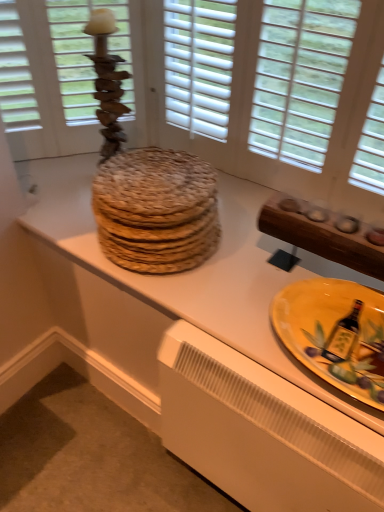
Question: Is wooden candlestick at upper left taller than yellow glazed plate at lower right?

Choices:
 (A) no
 (B) yes

Answer: (B)

Question: Is wooden candlestick at upper left further to camera compared to yellow glazed plate at lower right?

Choices:
 (A) yes
 (B) no

Answer: (A)

Question: From the image's perspective, is wooden candlestick at upper left located beneath yellow glazed plate at lower right?

Choices:
 (A) yes
 (B) no

Answer: (B)

Question: Is wooden candlestick at upper left surrounding yellow glazed plate at lower right?

Choices:
 (A) yes
 (B) no

Answer: (B)

Question: Is wooden candlestick at upper left aimed at yellow glazed plate at lower right?

Choices:
 (A) no
 (B) yes

Answer: (A)

Question: Considering the relative sizes of wooden candlestick at upper left and yellow glazed plate at lower right in the image provided, is wooden candlestick at upper left thinner than yellow glazed plate at lower right?

Choices:
 (A) no
 (B) yes

Answer: (B)

Question: From a real-world perspective, is yellow glazed plate at lower right physically above white plastic radiator at lower center?

Choices:
 (A) yes
 (B) no

Answer: (A)

Question: Is yellow glazed plate at lower right positioned before white plastic radiator at lower center?

Choices:
 (A) yes
 (B) no

Answer: (A)

Question: Is yellow glazed plate at lower right oriented towards white plastic radiator at lower center?

Choices:
 (A) yes
 (B) no

Answer: (B)

Question: Does yellow glazed plate at lower right appear on the left side of white plastic radiator at lower center?

Choices:
 (A) yes
 (B) no

Answer: (B)

Question: Is white plastic radiator at lower center completely or partially inside yellow glazed plate at lower right?

Choices:
 (A) no
 (B) yes

Answer: (A)

Question: From the image's perspective, is yellow glazed plate at lower right on white plastic radiator at lower center?

Choices:
 (A) no
 (B) yes

Answer: (B)

Question: Can you confirm if wooden candlestick at upper left is taller than wooden textured platters at center?

Choices:
 (A) no
 (B) yes

Answer: (B)